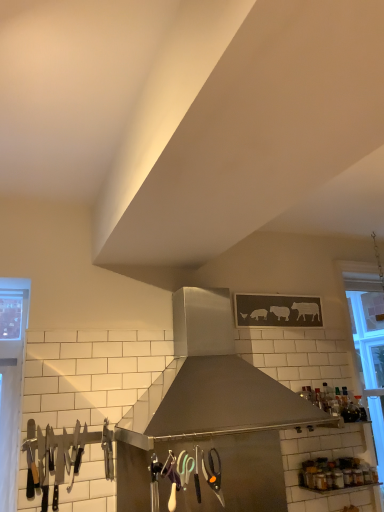
This screenshot has width=384, height=512. Describe the element at coordinates (369, 349) in the screenshot. I see `clear glass window at right` at that location.

Measure the distance between polished stainless steel knives at left and camera.

polished stainless steel knives at left is 1.83 meters away from camera.

Measure the distance between point [231,421] and camera.

Point [231,421] and camera are 1.76 meters apart.

In order to click on clear glass window at right in this screenshot , I will do `click(369, 349)`.

Can you tell me how much clear glass window at right and polished stainless steel knives at left differ in facing direction?

0.43 degrees.

Relative to polished stainless steel knives at left, is clear glass window at right in front or behind?

clear glass window at right is positioned farther from the viewer than polished stainless steel knives at left.

Which is behind, point (351, 313) or point (109, 464)?

Point (351, 313)

Between clear glass window at right and polished stainless steel knives at left, which one has smaller size?

polished stainless steel knives at left.

From a real-world perspective, is transparent glass bottle at upper right positioned under clear glass window at right based on gravity?

Indeed, from a real-world perspective, transparent glass bottle at upper right is positioned beneath clear glass window at right.

From the picture: Does transparent glass bottle at upper right lie behind clear glass window at right?

No, it is not.

Would you say transparent glass bottle at upper right is a long distance from clear glass window at right?

No.

Where is `bottle on the left of clear glass window at right`? bottle on the left of clear glass window at right is located at coordinates (360, 408).

From a real-world perspective, is stainless steel range hood at center positioned above or below clear glass window at right?

From a real-world perspective, stainless steel range hood at center is physically above clear glass window at right.

Can you tell me how much stainless steel range hood at center and clear glass window at right differ in facing direction?

They differ by 0.285 degrees in their facing directions.

Does stainless steel range hood at center have a greater width compared to clear glass window at right?

Yes.

Is stainless steel range hood at center located outside clear glass window at right?

Yes, stainless steel range hood at center is not within clear glass window at right.

Which is closer, (359, 406) or (285, 414)?

Point (359, 406) appears to be farther away from the viewer than point (285, 414).

Could you tell me if transparent glass bottle at upper right is facing stainless steel range hood at center?

No, transparent glass bottle at upper right is not oriented towards stainless steel range hood at center.

Would you consider transparent glass bottle at upper right to be distant from stainless steel range hood at center?

That's right, there is a large distance between transparent glass bottle at upper right and stainless steel range hood at center.

Between transparent glass bottle at upper right and stainless steel range hood at center, which one appears on the right side from the viewer's perspective?

transparent glass bottle at upper right is more to the right.

How different are the orientations of stainless steel range hood at center and transparent glass bottle at upper right in degrees?

2.17 degrees separate the facing orientations of stainless steel range hood at center and transparent glass bottle at upper right.

Based on the photo, would you say stainless steel range hood at center is to the left or to the right of transparent glass bottle at upper right in the picture?

In the image, stainless steel range hood at center appears on the left side of transparent glass bottle at upper right.

Who is smaller, stainless steel range hood at center or transparent glass bottle at upper right?

transparent glass bottle at upper right is smaller.

Is stainless steel range hood at center located outside transparent glass bottle at upper right?

stainless steel range hood at center is positioned outside transparent glass bottle at upper right.

Can you tell me how much polished stainless steel knives at left and clear glass window at right differ in facing direction?

polished stainless steel knives at left and clear glass window at right are facing 0.43 degrees away from each other.

Consider the image. Which object is wider, polished stainless steel knives at left or clear glass window at right?

clear glass window at right is wider.

Measure the distance between polished stainless steel knives at left and clear glass window at right.

polished stainless steel knives at left is 5.79 feet from clear glass window at right.

Considering the positions of objects polished stainless steel knives at left and clear glass window at right in the image provided, who is behind, polished stainless steel knives at left or clear glass window at right?

clear glass window at right is behind.

Can you confirm if clear glass window at right is positioned to the right of transparent glass bottle at upper right?

Yes.

From the picture: Is clear glass window at right oriented towards transparent glass bottle at upper right?

No.

Between clear glass window at right and transparent glass bottle at upper right, which one has more height?

clear glass window at right.

You are a GUI agent. You are given a task and a screenshot of the screen. Output one action in this format:
    pyautogui.click(x=<x>, y=<y>)
    Task: Click on the silverware to the left of clear glass window at right
    Image resolution: width=384 pixels, height=512 pixels.
    Given the screenshot: What is the action you would take?
    pyautogui.click(x=61, y=457)

The width and height of the screenshot is (384, 512). I want to click on window above the transparent glass bottle at upper right (from the image's perspective), so coord(369,349).

Based on their spatial positions, is polished stainless steel knives at left or clear glass window at right closer to transparent glass bottle at upper right?

Based on the image, clear glass window at right appears to be nearer to transparent glass bottle at upper right.

When comparing their distances from clear glass window at right, does stainless steel range hood at center or polished stainless steel knives at left seem closer?

stainless steel range hood at center lies closer to clear glass window at right than the other object.

When comparing their distances from transparent glass bottle at upper right, does clear glass window at right or polished stainless steel knives at left seem further?

polished stainless steel knives at left lies further to transparent glass bottle at upper right than the other object.

Considering their positions, is polished stainless steel knives at left positioned closer to clear glass window at right than stainless steel range hood at center?

stainless steel range hood at center lies closer to clear glass window at right than the other object.

Looking at the image, which one is located closer to stainless steel range hood at center, transparent glass bottle at upper right or polished stainless steel knives at left?

polished stainless steel knives at left is positioned closer to the anchor stainless steel range hood at center.

From the image, which object appears to be farther from transparent glass bottle at upper right, clear glass window at right or stainless steel range hood at center?

The object further to transparent glass bottle at upper right is stainless steel range hood at center.

Estimate the real-world distances between objects in this image. Which object is further from transparent glass bottle at upper right, polished stainless steel knives at left or stainless steel range hood at center?

polished stainless steel knives at left.

From the picture: Which object lies nearer to the anchor point polished stainless steel knives at left, transparent glass bottle at upper right or stainless steel range hood at center?

stainless steel range hood at center is closer to polished stainless steel knives at left.

Where is `kitchen appliance between polished stainless steel knives at left and clear glass window at right from left to right`? The width and height of the screenshot is (384, 512). kitchen appliance between polished stainless steel knives at left and clear glass window at right from left to right is located at coordinates (211, 381).

You are a GUI agent. You are given a task and a screenshot of the screen. Output one action in this format:
    pyautogui.click(x=<x>, y=<y>)
    Task: Click on the bottle located between polished stainless steel knives at left and clear glass window at right in the left-right direction
    The image size is (384, 512).
    Given the screenshot: What is the action you would take?
    click(360, 408)

At what (x,y) coordinates should I click in order to perform the action: click on bottle between stainless steel range hood at center and clear glass window at right from left to right. Please return your answer as a coordinate pair (x, y). This screenshot has width=384, height=512. Looking at the image, I should click on (360, 408).

The image size is (384, 512). Find the location of `kitchen appliance between polished stainless steel knives at left and transparent glass bottle at upper right from left to right`. kitchen appliance between polished stainless steel knives at left and transparent glass bottle at upper right from left to right is located at coordinates (211, 381).